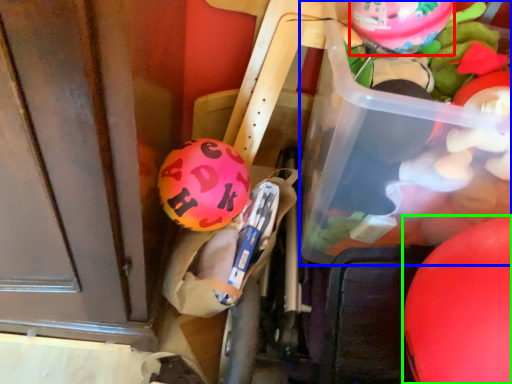
Question: Estimate the real-world distances between objects in this image. Which object is closer to balloon (highlighted by a red box), wide (highlighted by a blue box) or balloon (highlighted by a green box)?

Choices:
 (A) wide
 (B) balloon

Answer: (A)